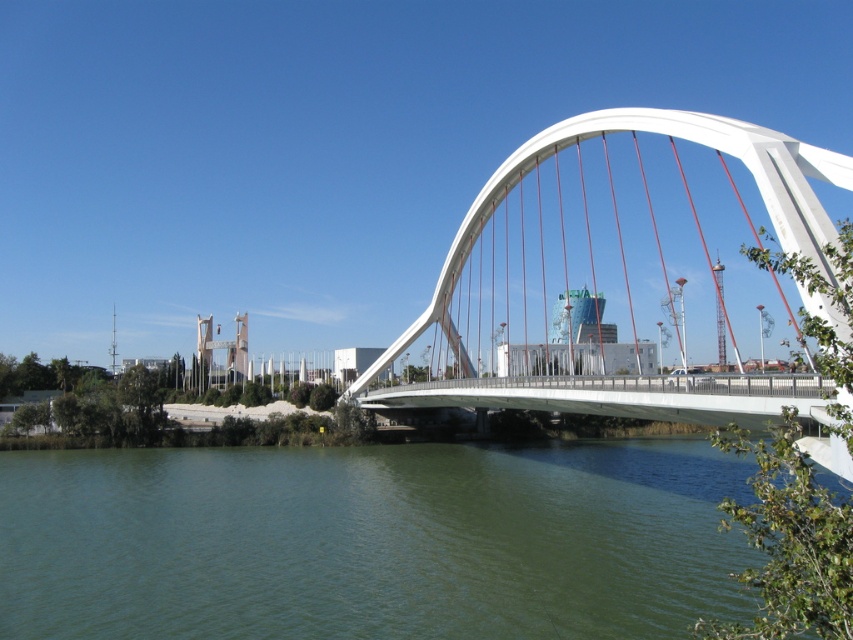
Question: Which point is farther to the camera?

Choices:
 (A) (425, 634)
 (B) (813, 442)

Answer: (A)

Question: Which object appears farthest from the camera in this image?

Choices:
 (A) green water at lower center
 (B) white metallic arch bridge at center

Answer: (A)

Question: Which point appears farthest from the camera in this image?

Choices:
 (A) (445, 310)
 (B) (477, 493)

Answer: (A)

Question: Considering the relative positions of green water at lower center and white metallic arch bridge at center in the image provided, where is green water at lower center located with respect to white metallic arch bridge at center?

Choices:
 (A) left
 (B) right

Answer: (A)

Question: Where is green water at lower center located in relation to white metallic arch bridge at center in the image?

Choices:
 (A) below
 (B) above

Answer: (A)

Question: Does green water at lower center have a lesser width compared to white metallic arch bridge at center?

Choices:
 (A) yes
 (B) no

Answer: (B)